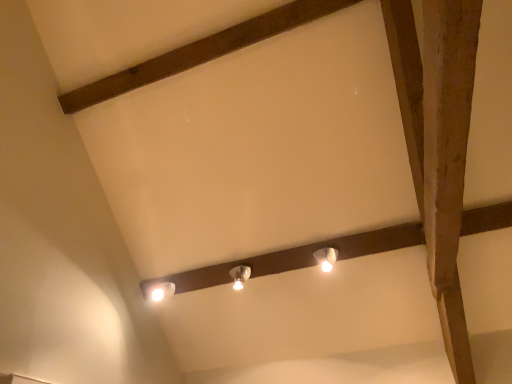
Question: In terms of height, does brown wooden plank at upper center look taller or shorter compared to white glossy lamp at center, which is counted as the 1th lamp, starting from the left?

Choices:
 (A) tall
 (B) short

Answer: (B)

Question: From the image's perspective, is brown wooden plank at upper center above or below white glossy lamp at center, which appears as the 2th lamp when viewed from the right?

Choices:
 (A) below
 (B) above

Answer: (B)

Question: Considering the real-world distances, which object is farthest from the white glossy lamp at upper center, the second lamp viewed from the left?

Choices:
 (A) brown wooden plank at upper center
 (B) white glossy lamp at center, which appears as the 2th lamp when viewed from the right

Answer: (A)

Question: Which object is the farthest from the brown wooden plank at upper center?

Choices:
 (A) white glossy lamp at upper center, the second lamp viewed from the left
 (B) white glossy lamp at center, which is counted as the 1th lamp, starting from the left

Answer: (A)